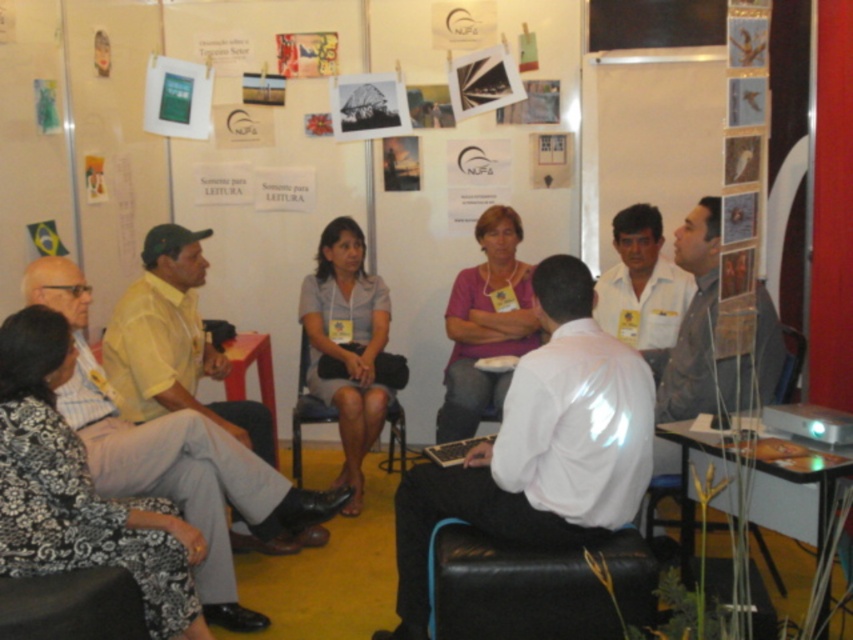
Does pink fabric shirt at center have a lesser height compared to wooden chair at lower right?

No.

Between pink fabric shirt at center and wooden chair at lower right, which one is positioned higher?

pink fabric shirt at center is higher up.

Locate an element on the screen. This screenshot has height=640, width=853. pink fabric shirt at center is located at coordinates (485, 324).

Find the location of a particular element. pink fabric shirt at center is located at coordinates [x=485, y=324].

How far apart are pink fabric shirt at center and white shirt at center?

pink fabric shirt at center is 20.83 inches away from white shirt at center.

Locate an element on the screen. Image resolution: width=853 pixels, height=640 pixels. pink fabric shirt at center is located at coordinates (485, 324).

The height and width of the screenshot is (640, 853). In order to click on pink fabric shirt at center in this screenshot , I will do coord(485,324).

Between point (575, 364) and point (473, 284), which one is positioned in front?

Positioned in front is point (575, 364).

Describe the element at coordinates (540, 445) in the screenshot. I see `white glossy shirt at center` at that location.

Describe the element at coordinates (540, 445) in the screenshot. I see `white glossy shirt at center` at that location.

This screenshot has height=640, width=853. I want to click on white glossy shirt at center, so click(540, 445).